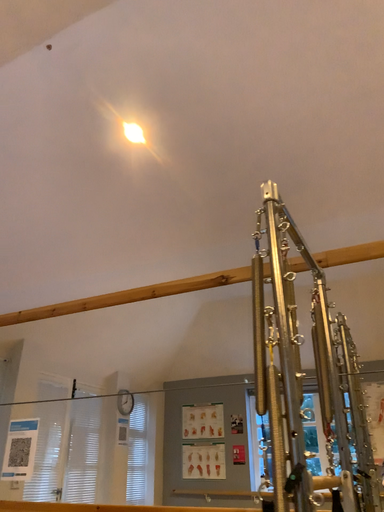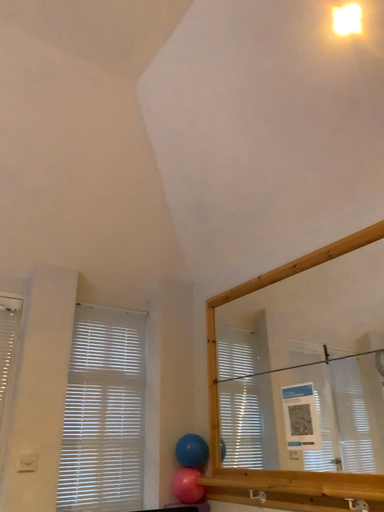
Question: Which way did the camera rotate in the video?

Choices:
 (A) rotated downward
 (B) rotated upward

Answer: (A)